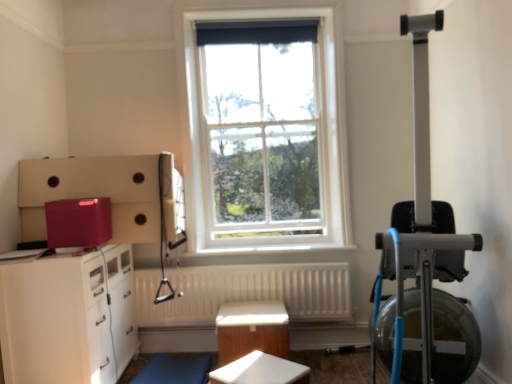
Question: Can you confirm if white glossy cabinet at lower left is bigger than white glass window at center?

Choices:
 (A) yes
 (B) no

Answer: (A)

Question: Is white glossy cabinet at lower left at the right side of white glass window at center?

Choices:
 (A) yes
 (B) no

Answer: (B)

Question: Considering the relative sizes of white glossy cabinet at lower left and white glass window at center in the image provided, is white glossy cabinet at lower left taller than white glass window at center?

Choices:
 (A) yes
 (B) no

Answer: (B)

Question: Would you consider white glossy cabinet at lower left to be distant from white glass window at center?

Choices:
 (A) yes
 (B) no

Answer: (A)

Question: Is white glossy cabinet at lower left outside white glass window at center?

Choices:
 (A) no
 (B) yes

Answer: (B)

Question: From a real-world perspective, is white matte table at center, marked as the 1th table in a front-to-back arrangement, above or below white textured radiator at center?

Choices:
 (A) below
 (B) above

Answer: (A)

Question: Considering the positions of white matte table at center, marked as the 1th table in a front-to-back arrangement, and white textured radiator at center in the image, is white matte table at center, marked as the 1th table in a front-to-back arrangement, taller or shorter than white textured radiator at center?

Choices:
 (A) short
 (B) tall

Answer: (A)

Question: From the image's perspective, is white matte table at center, marked as the 1th table in a front-to-back arrangement, located above or below white textured radiator at center?

Choices:
 (A) above
 (B) below

Answer: (B)

Question: Based on their positions, is white matte table at center, marked as the 1th table in a front-to-back arrangement, located to the left or right of white textured radiator at center?

Choices:
 (A) right
 (B) left

Answer: (A)

Question: Considering the positions of white glossy cabinet at lower left and white glass window at center in the image, is white glossy cabinet at lower left wider or thinner than white glass window at center?

Choices:
 (A) thin
 (B) wide

Answer: (B)

Question: Is white glossy cabinet at lower left to the left or to the right of white glass window at center in the image?

Choices:
 (A) right
 (B) left

Answer: (B)

Question: Is white glossy cabinet at lower left situated inside white glass window at center or outside?

Choices:
 (A) outside
 (B) inside

Answer: (A)

Question: From a real-world perspective, relative to white glass window at center, is white glossy cabinet at lower left vertically above or below?

Choices:
 (A) below
 (B) above

Answer: (A)

Question: From a real-world perspective, relative to white textured radiator at center, is white glossy cabinet at lower left vertically above or below?

Choices:
 (A) above
 (B) below

Answer: (A)

Question: Does point (91, 311) appear closer or farther from the camera than point (195, 311)?

Choices:
 (A) closer
 (B) farther

Answer: (A)